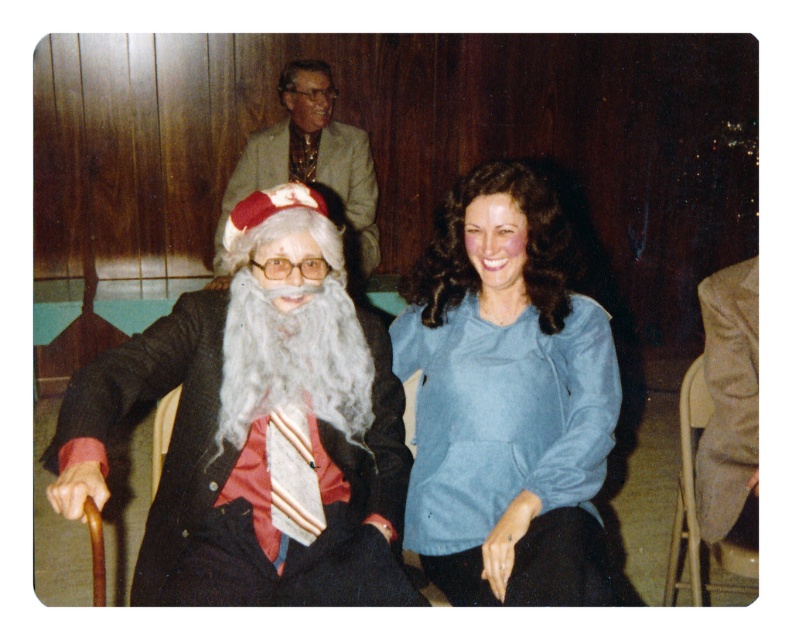
Looking at this image, is matte black santa at left to the left of light brown textured suit at upper center from the viewer's perspective?

No, matte black santa at left is not to the left of light brown textured suit at upper center.

Who is positioned more to the left, matte black santa at left or light brown textured suit at upper center?

Positioned to the left is light brown textured suit at upper center.

Does point (326, 529) come closer to viewer compared to point (263, 148)?

Yes, point (326, 529) is in front of point (263, 148).

Where is `matte black santa at left`? This screenshot has width=792, height=640. matte black santa at left is located at coordinates (257, 428).

Which is above, blue velvety blouse at center or light brown textured suit at upper center?

light brown textured suit at upper center

Which is behind, point (398, 336) or point (345, 148)?

The point (345, 148) is more distant.

Is point (497, 308) farther from viewer compared to point (299, 88)?

No, it is not.

Locate an element on the screen. The image size is (792, 640). blue velvety blouse at center is located at coordinates (505, 401).

Which of these two, blue velvety blouse at center or metallic gray chair at lower right, stands taller?

Standing taller between the two is blue velvety blouse at center.

Locate an element on the screen. blue velvety blouse at center is located at coordinates (505, 401).

In order to click on blue velvety blouse at center in this screenshot , I will do `click(505, 401)`.